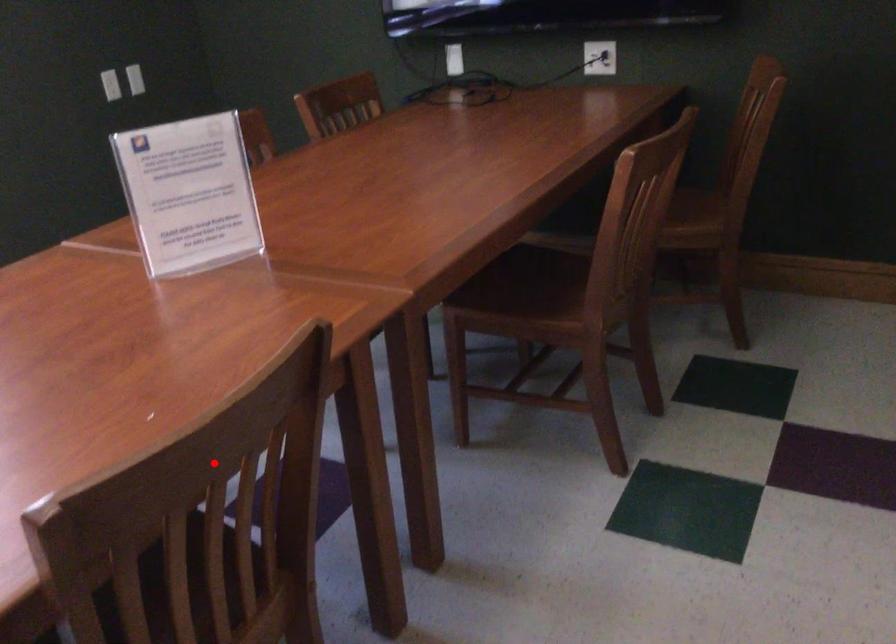
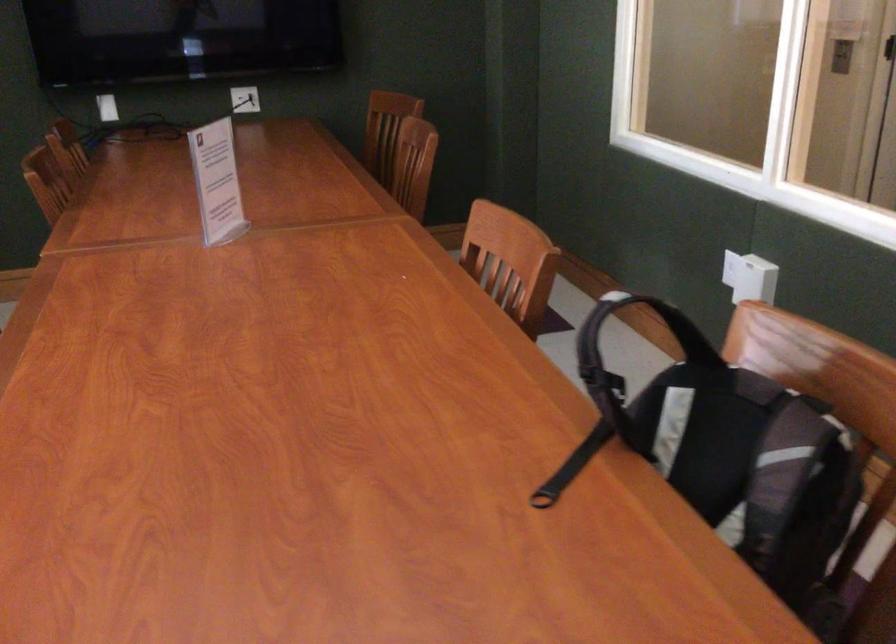
Question: A red point is marked in image1. In image2, is the corresponding 3D point closer to the camera or farther? Reply with the corresponding letter.

Choices:
 (A) The corresponding 3D point is closer.
 (B) The corresponding 3D point is farther.

Answer: (B)